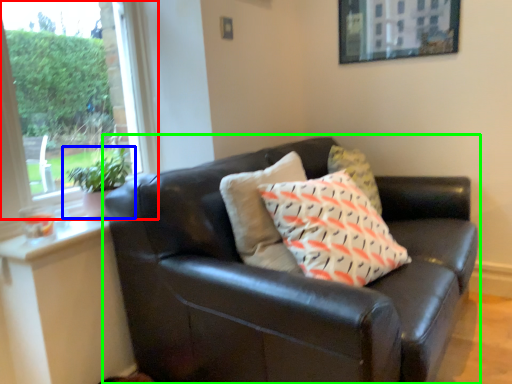
Question: Which is nearer to the window (highlighted by a red box)? houseplant (highlighted by a blue box) or studio couch (highlighted by a green box).

Choices:
 (A) houseplant
 (B) studio couch

Answer: (A)